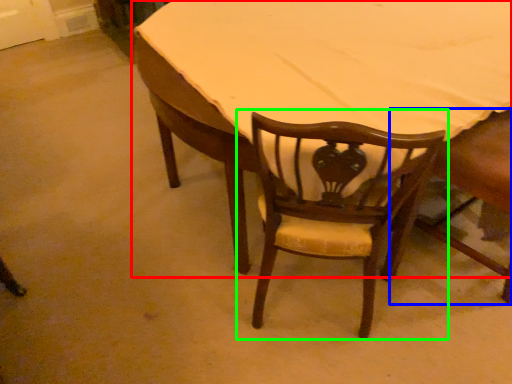
Question: Which object is the farthest from table (highlighted by a red box)? Choose among these: chair (highlighted by a blue box) or chair (highlighted by a green box).

Choices:
 (A) chair
 (B) chair

Answer: (A)